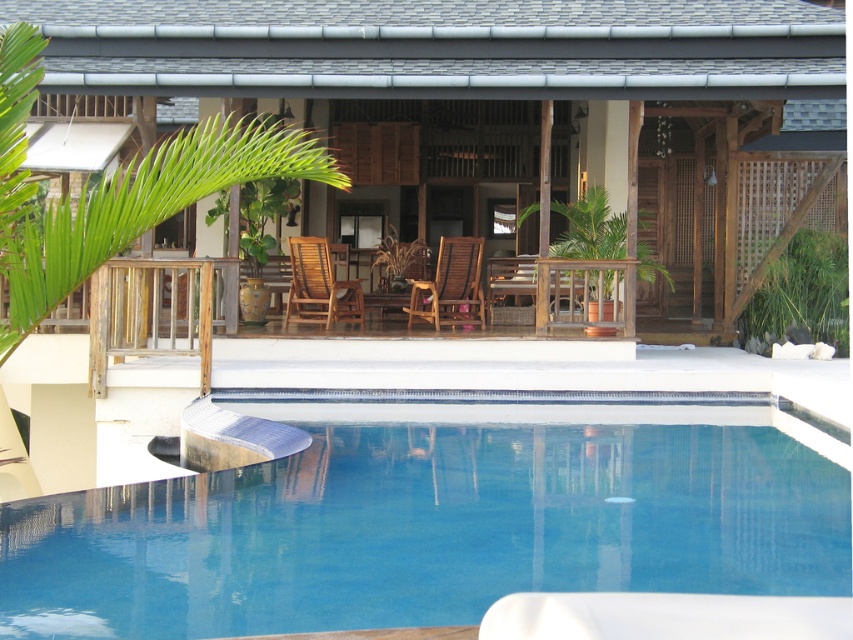
You are a guest at a poolside event and want to place a 1.5 meter tall umbrella next to the clear glass pool at center and the teak wood armchair at center. Which object should you place the umbrella next to to ensure it doesn

The clear glass pool at center has a lesser height compared to the teak wood armchair at center. Therefore, you should place the umbrella next to the teak wood armchair at center to ensure it can provide adequate shade since the armchair is taller than the pool.

You are planning to host a small gathering and need to determine the space available. Based on the image, which object occupies more horizontal space between the wooden hut at center and the clear glass pool at center?

The wooden hut at center might be wider than clear glass pool at center, so it likely occupies more horizontal space.

Looking at this image, you are planning to host a small gathering and need to place a 6.5 feet long table between the wooden hut at center and the brown wooden armchair at center. Would there be enough space to fit the table between them?

The wooden hut at center and brown wooden armchair at center are 6.81 feet apart from each other. Since the table is 6.5 feet long, there is enough space to fit it between them as the distance between the two objects is slightly larger than the table length.